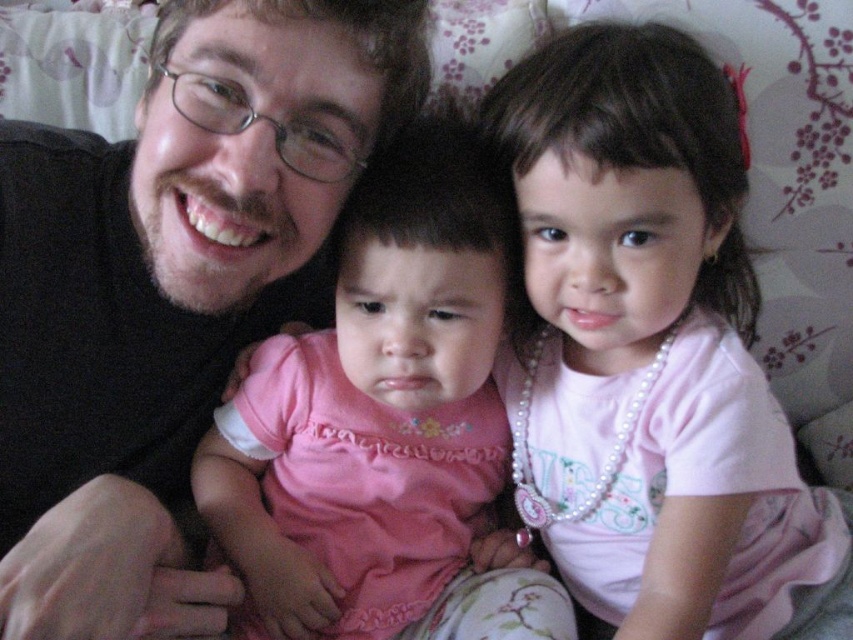
Question: Which point appears closest to the camera in this image?

Choices:
 (A) (222, 445)
 (B) (788, 628)

Answer: (B)

Question: Is pearl necklace at upper right smaller than pink satin dress at center?

Choices:
 (A) no
 (B) yes

Answer: (A)

Question: Which object is positioned farthest from the pink satin dress at center?

Choices:
 (A) pearl necklace at upper right
 (B) matte black shirt at left

Answer: (A)

Question: Which object is the closest to the matte black shirt at left?

Choices:
 (A) pink satin dress at center
 (B) pearl necklace at upper right

Answer: (A)

Question: Is the position of pearl necklace at upper right less distant than that of pink satin dress at center?

Choices:
 (A) no
 (B) yes

Answer: (B)

Question: Is matte black shirt at left to the left of pearl necklace at upper right from the viewer's perspective?

Choices:
 (A) yes
 (B) no

Answer: (A)